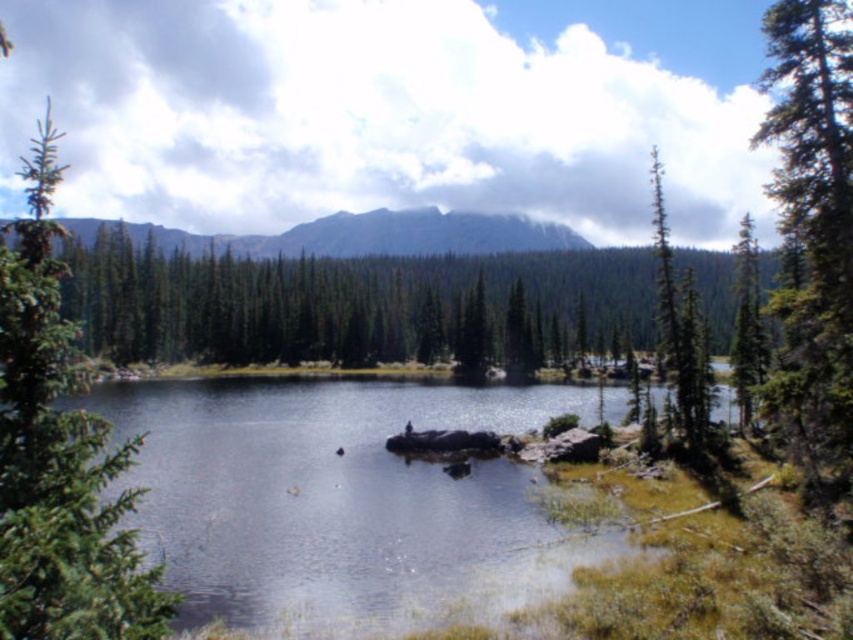
Is point (10, 522) closer to viewer compared to point (276, 237)?

Yes, it is.

Is green matte tree at left thinner than rugged granite mountain at upper center?

Correct, green matte tree at left's width is less than rugged granite mountain at upper center's.

Is point (122, 589) farther from camera compared to point (223, 241)?

No, it is not.

Where is `green matte tree at left`? Image resolution: width=853 pixels, height=640 pixels. green matte tree at left is located at coordinates (59, 456).

Is green matte tree at left closer to the viewer compared to green textured tree at upper right?

Yes.

Does point (22, 636) come in front of point (679, 388)?

Yes, it is in front of point (679, 388).

This screenshot has width=853, height=640. I want to click on green matte tree at left, so (x=59, y=456).

I want to click on green matte tree at left, so click(59, 456).

The height and width of the screenshot is (640, 853). What do you see at coordinates (813, 218) in the screenshot?
I see `green textured tree at right` at bounding box center [813, 218].

Which is above, green textured tree at right or green matte tree at right?

green textured tree at right is higher up.

This screenshot has height=640, width=853. What do you see at coordinates (813, 218) in the screenshot?
I see `green textured tree at right` at bounding box center [813, 218].

I want to click on green textured tree at right, so click(813, 218).